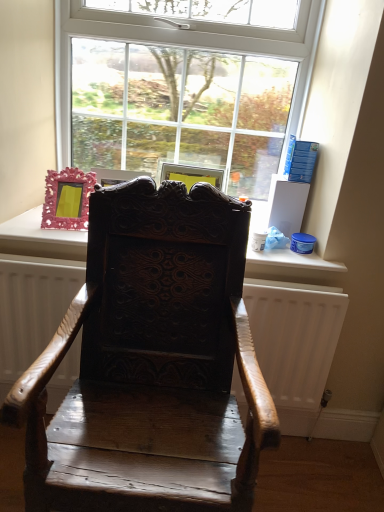
Describe the element at coordinates (67, 199) in the screenshot. The width and height of the screenshot is (384, 512). I see `pink plastic picture frame at upper left` at that location.

Image resolution: width=384 pixels, height=512 pixels. I want to click on wooden radiator at center, so click(x=294, y=337).

Find the location of `clear glass window at upper center`. clear glass window at upper center is located at coordinates (183, 85).

In order to click on picture frame to the left of wooden radiator at center in this screenshot , I will do `click(67, 199)`.

Looking at this image, which is in front, pink plastic picture frame at upper left or wooden radiator at center?

wooden radiator at center is in front.

Are pink plastic picture frame at upper left and wooden radiator at center making contact?

No, pink plastic picture frame at upper left is not with wooden radiator at center.

From a real-world perspective, between pink plastic picture frame at upper left and wooden radiator at center, who is vertically lower?

wooden radiator at center, from a real-world perspective.

Does point (17, 282) appear closer or farther from the camera than point (179, 71)?

Point (17, 282) appears to be closer to the viewer than point (179, 71).

How far apart are wooden radiator at center and clear glass window at upper center?

The distance of wooden radiator at center from clear glass window at upper center is 34.21 inches.

Would you say wooden radiator at center is outside clear glass window at upper center?

Yes, wooden radiator at center is located beyond the bounds of clear glass window at upper center.

Based on their sizes in the image, would you say wooden radiator at center is bigger or smaller than clear glass window at upper center?

In the image, wooden radiator at center appears to be larger than clear glass window at upper center.

Is pink plastic picture frame at upper left positioned with its back to dark wood carved chair at center?

That's not correct — pink plastic picture frame at upper left is not looking away from dark wood carved chair at center.

Is pink plastic picture frame at upper left placed right next to dark wood carved chair at center?

No, pink plastic picture frame at upper left is not making contact with dark wood carved chair at center.

From a real-world perspective, is pink plastic picture frame at upper left above or below dark wood carved chair at center?

Clearly, from a real-world perspective, pink plastic picture frame at upper left is above dark wood carved chair at center.

Image resolution: width=384 pixels, height=512 pixels. Identify the location of chair in front of the pink plastic picture frame at upper left. tap(151, 362).

Which object is wider, clear glass window at upper center or dark wood carved chair at center?

dark wood carved chair at center is wider.

Considering the points (299, 106) and (163, 373), which point is behind, point (299, 106) or point (163, 373)?

The point (299, 106) is more distant.

Is dark wood carved chair at center inside clear glass window at upper center?

No, dark wood carved chair at center is located outside of clear glass window at upper center.

Considering the sizes of objects clear glass window at upper center and dark wood carved chair at center in the image provided, who is smaller, clear glass window at upper center or dark wood carved chair at center?

With smaller size is clear glass window at upper center.

Is clear glass window at upper center to the left or to the right of pink plastic picture frame at upper left in the image?

clear glass window at upper center is to the right of pink plastic picture frame at upper left.

Considering the sizes of objects clear glass window at upper center and pink plastic picture frame at upper left in the image provided, who is shorter, clear glass window at upper center or pink plastic picture frame at upper left?

pink plastic picture frame at upper left is shorter.

Would you say clear glass window at upper center is inside or outside pink plastic picture frame at upper left?

clear glass window at upper center is not enclosed by pink plastic picture frame at upper left.

Which of these two, clear glass window at upper center or pink plastic picture frame at upper left, is smaller?

pink plastic picture frame at upper left.

Can you tell me how much wooden radiator at center and dark wood carved chair at center differ in facing direction?

The facing directions of wooden radiator at center and dark wood carved chair at center are 0.533 degrees apart.

Which object is wider, wooden radiator at center or dark wood carved chair at center?

With larger width is dark wood carved chair at center.

Considering the positions of objects wooden radiator at center and dark wood carved chair at center in the image provided, who is behind, wooden radiator at center or dark wood carved chair at center?

wooden radiator at center.

Is wooden radiator at center surrounding dark wood carved chair at center?

Actually, dark wood carved chair at center is outside wooden radiator at center.

Does dark wood carved chair at center come behind pink plastic picture frame at upper left?

No, dark wood carved chair at center is closer to the camera.

Is dark wood carved chair at center positioned beyond the bounds of pink plastic picture frame at upper left?

Yes, dark wood carved chair at center is outside of pink plastic picture frame at upper left.

Is dark wood carved chair at center aimed at pink plastic picture frame at upper left?

No.

From a real-world perspective, which is physically above, dark wood carved chair at center or pink plastic picture frame at upper left?

pink plastic picture frame at upper left is physically above.

Find the location of a particular element. The width and height of the screenshot is (384, 512). picture frame that appears behind the wooden radiator at center is located at coordinates (67, 199).

This screenshot has width=384, height=512. I want to click on radiator below the clear glass window at upper center (from a real-world perspective), so click(x=294, y=337).

Based on their spatial positions, is wooden radiator at center or dark wood carved chair at center further from clear glass window at upper center?

Based on the image, wooden radiator at center appears to be further to clear glass window at upper center.

Based on their spatial positions, is pink plastic picture frame at upper left or dark wood carved chair at center further from wooden radiator at center?

Based on the image, pink plastic picture frame at upper left appears to be further to wooden radiator at center.

Which object lies nearer to the anchor point pink plastic picture frame at upper left, dark wood carved chair at center or wooden radiator at center?

dark wood carved chair at center is positioned closer to the anchor pink plastic picture frame at upper left.

Considering their positions, is clear glass window at upper center positioned closer to wooden radiator at center than pink plastic picture frame at upper left?

pink plastic picture frame at upper left is positioned closer to the anchor wooden radiator at center.

Which object lies further to the anchor point pink plastic picture frame at upper left, wooden radiator at center or clear glass window at upper center?

Based on the image, wooden radiator at center appears to be further to pink plastic picture frame at upper left.

Which object lies further to the anchor point wooden radiator at center, dark wood carved chair at center or pink plastic picture frame at upper left?

pink plastic picture frame at upper left is positioned further to the anchor wooden radiator at center.

From the picture: Which object lies further to the anchor point dark wood carved chair at center, pink plastic picture frame at upper left or clear glass window at upper center?

Among the two, clear glass window at upper center is located further to dark wood carved chair at center.

Considering their positions, is dark wood carved chair at center positioned further to clear glass window at upper center than pink plastic picture frame at upper left?

dark wood carved chair at center.

Locate an element on the screen. picture frame between clear glass window at upper center and dark wood carved chair at center in the vertical direction is located at coordinates (67, 199).

This screenshot has height=512, width=384. In order to click on picture frame between clear glass window at upper center and wooden radiator at center vertically in this screenshot , I will do `click(67, 199)`.

I want to click on radiator positioned between dark wood carved chair at center and pink plastic picture frame at upper left from near to far, so click(x=294, y=337).

Where is `chair between clear glass window at upper center and wooden radiator at center from top to bottom`? The height and width of the screenshot is (512, 384). chair between clear glass window at upper center and wooden radiator at center from top to bottom is located at coordinates (151, 362).